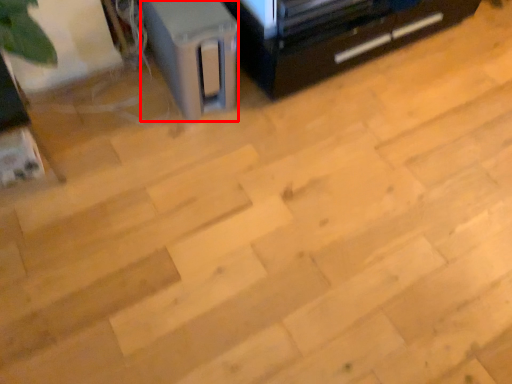
Question: From the image's perspective, what is the correct spatial relationship of appliance (annotated by the red box) in relation to furniture?

Choices:
 (A) below
 (B) above

Answer: (A)